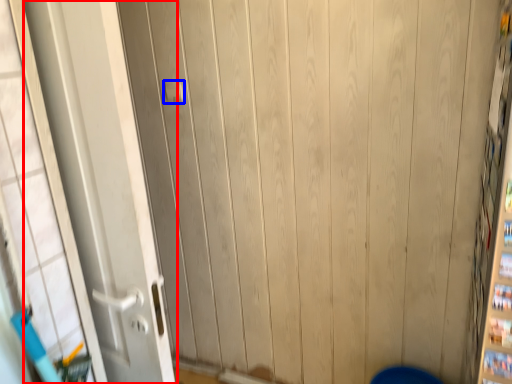
Question: Which object is closer to the camera taking this photo, door (highlighted by a red box) or door handle (highlighted by a blue box)?

Choices:
 (A) door
 (B) door handle

Answer: (A)